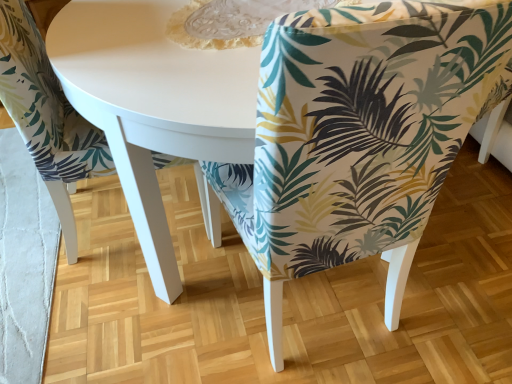
Question: Considering the relative sizes of printed fabric chair at center, the 1th chair viewed from the right, and printed fabric chair at center, the second chair positioned from the right, in the image provided, is printed fabric chair at center, the 1th chair viewed from the right, wider than printed fabric chair at center, the second chair positioned from the right,?

Choices:
 (A) no
 (B) yes

Answer: (A)

Question: From the image's perspective, would you say printed fabric chair at center, the 1th chair viewed from the right, is shown under printed fabric chair at center, which is counted as the 1th chair, starting from the left?

Choices:
 (A) yes
 (B) no

Answer: (A)

Question: Is printed fabric chair at center, marked as the second chair in a left-to-right arrangement, turned away from printed fabric chair at center, the second chair positioned from the right?

Choices:
 (A) yes
 (B) no

Answer: (B)

Question: Would you say printed fabric chair at center, the 1th chair viewed from the right, contains printed fabric chair at center, the second chair positioned from the right?

Choices:
 (A) yes
 (B) no

Answer: (B)

Question: Is printed fabric chair at center, marked as the second chair in a left-to-right arrangement, bigger than printed fabric chair at center, which is counted as the 1th chair, starting from the left?

Choices:
 (A) yes
 (B) no

Answer: (A)

Question: Is printed fabric chair at center, marked as the second chair in a left-to-right arrangement, thinner than printed fabric chair at center, which is counted as the 1th chair, starting from the left?

Choices:
 (A) yes
 (B) no

Answer: (A)

Question: Does printed fabric chair at center, which is counted as the 1th chair, starting from the left, have a greater height compared to printed fabric chair at center, marked as the second chair in a left-to-right arrangement?

Choices:
 (A) no
 (B) yes

Answer: (A)

Question: Can you confirm if printed fabric chair at center, which is counted as the 1th chair, starting from the left, is positioned to the left of printed fabric chair at center, the 1th chair viewed from the right?

Choices:
 (A) no
 (B) yes

Answer: (B)

Question: From the image's perspective, does printed fabric chair at center, the second chair positioned from the right, appear lower than printed fabric chair at center, the 1th chair viewed from the right?

Choices:
 (A) no
 (B) yes

Answer: (A)

Question: From a real-world perspective, does printed fabric chair at center, which is counted as the 1th chair, starting from the left, sit lower than printed fabric chair at center, the 1th chair viewed from the right?

Choices:
 (A) no
 (B) yes

Answer: (B)

Question: From a real-world perspective, is printed fabric chair at center, the second chair positioned from the right, on top of printed fabric chair at center, the 1th chair viewed from the right?

Choices:
 (A) yes
 (B) no

Answer: (B)

Question: Would you say printed fabric chair at center, which is counted as the 1th chair, starting from the left, is outside printed fabric chair at center, marked as the second chair in a left-to-right arrangement?

Choices:
 (A) no
 (B) yes

Answer: (B)

Question: Does point (391, 77) appear closer or farther from the camera than point (74, 124)?

Choices:
 (A) farther
 (B) closer

Answer: (B)